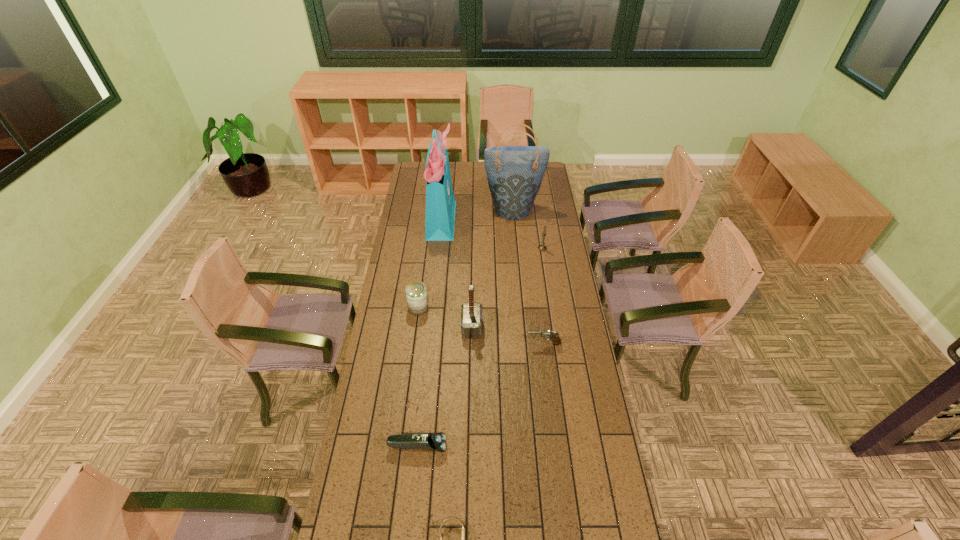
I want to click on vacant area between the left shopping bag and the hammer, so click(457, 273).

What are the coordinates of `unoccupied position between the left shopping bag and the fifth tallest object` in the screenshot? It's located at (430, 263).

Where is `free space between the left shopping bag and the hammer`? free space between the left shopping bag and the hammer is located at coordinates (457, 273).

I want to click on free space between the fifth tallest object and the hammer, so click(x=445, y=318).

This screenshot has height=540, width=960. I want to click on empty space between the pistol and the electric shaver, so click(481, 395).

The width and height of the screenshot is (960, 540). I want to click on the seventh closest object relative to the nearest object, so click(514, 173).

Point out which object is positioned as the nearest to the fourth tallest object. Please provide its 2D coordinates. Your answer should be formatted as a tuple, i.e. [(x, y)], where the tuple contains the x and y coordinates of a point satisfying the conditions above.

[(514, 173)]